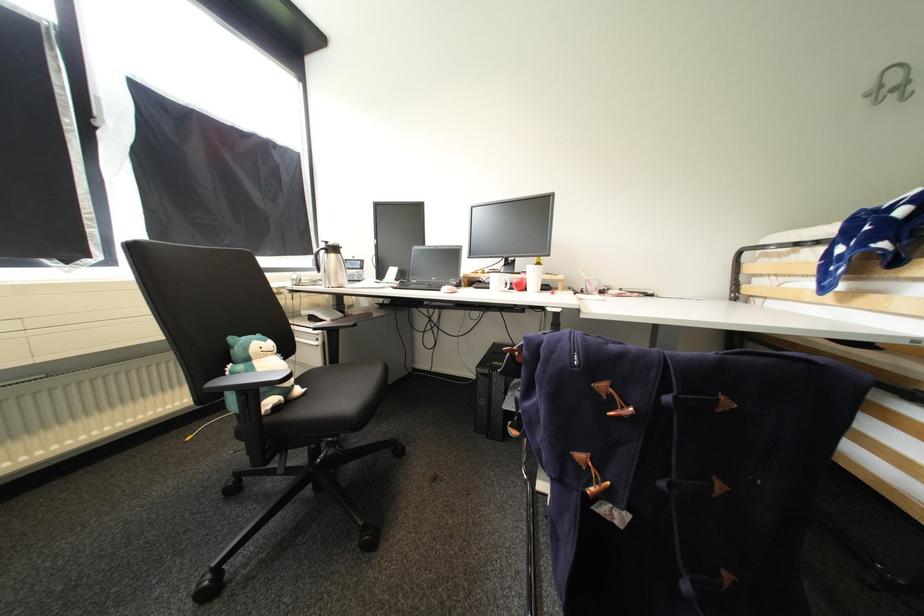
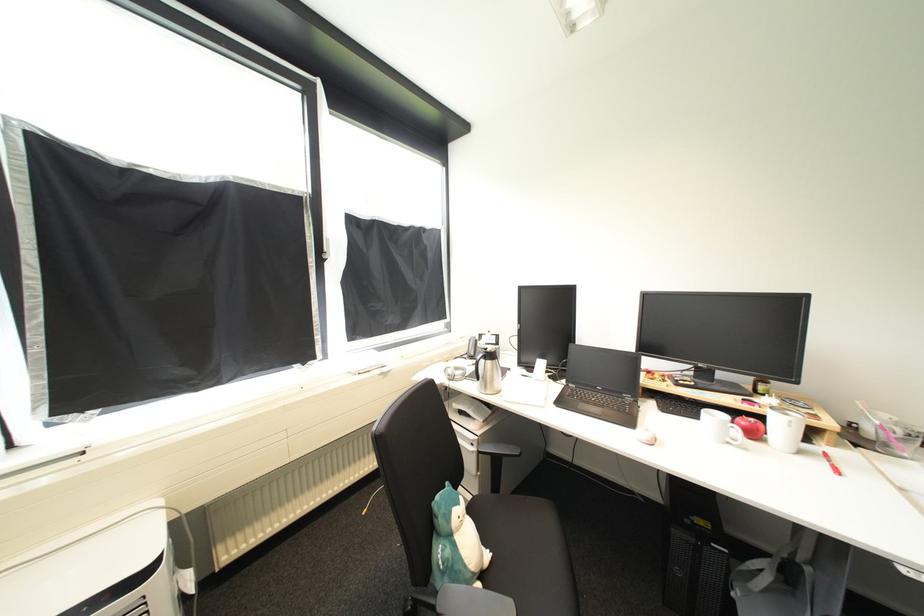
Where in the second image is the point corresponding to point 306,391 from the first image?

(493, 557)